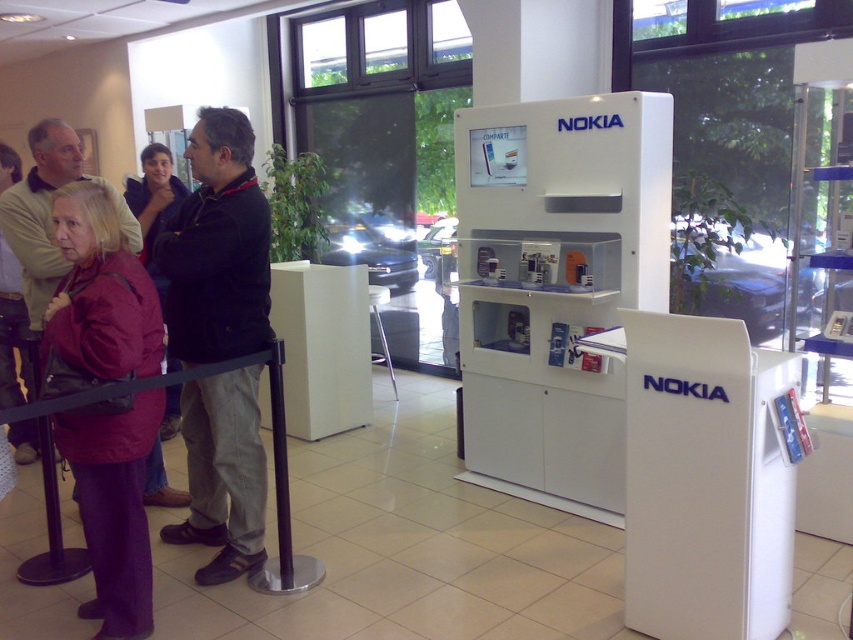
How much distance is there between dark gray fabric jacket at left and matte red jacket at left?

dark gray fabric jacket at left and matte red jacket at left are 25.78 inches apart.

Is point (27, 300) in front of point (163, 160)?

Yes, point (27, 300) is in front of point (163, 160).

Between point (39, 278) and point (132, 180), which one is positioned behind?

The point (132, 180) is more distant.

The image size is (853, 640). In order to click on dark gray fabric jacket at left in this screenshot , I will do `click(48, 212)`.

Does point (218, 260) lie behind point (136, 240)?

No, (218, 260) is closer to viewer.

The width and height of the screenshot is (853, 640). In order to click on dark gray jacket at center in this screenshot , I will do `click(218, 248)`.

I want to click on dark gray jacket at center, so click(218, 248).

What do you see at coordinates (218, 248) in the screenshot? This screenshot has height=640, width=853. I see `dark gray jacket at center` at bounding box center [218, 248].

Is point (207, 260) closer to camera compared to point (155, 474)?

Yes, it is.

Locate an element on the screen. dark gray jacket at center is located at coordinates (218, 248).